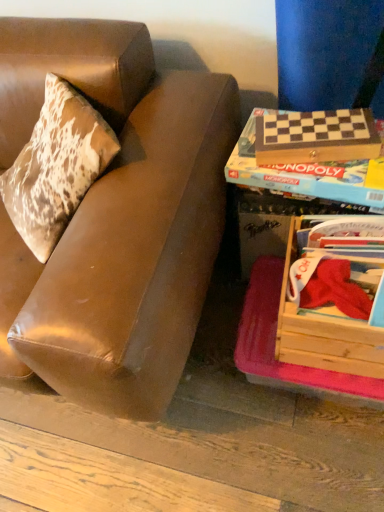
Locate an element on the screen. Image resolution: width=384 pixels, height=512 pixels. blank space situated above wooden crate at lower right (from a real-world perspective) is located at coordinates (340, 255).